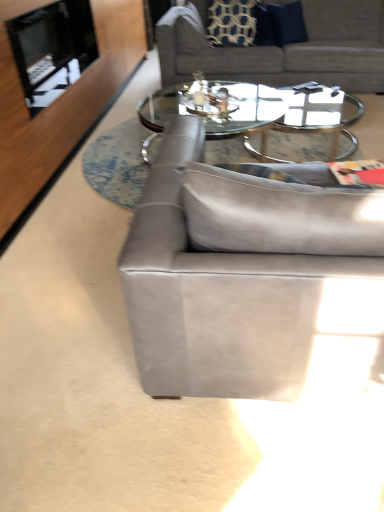
What do you see at coordinates (247, 274) in the screenshot? The height and width of the screenshot is (512, 384). I see `suede gray couch at center, the 1th studio couch viewed from the front` at bounding box center [247, 274].

The image size is (384, 512). What do you see at coordinates (253, 112) in the screenshot?
I see `clear glass coffee table at center` at bounding box center [253, 112].

The height and width of the screenshot is (512, 384). Describe the element at coordinates (282, 48) in the screenshot. I see `suede gray couch at upper center, which is counted as the 1th studio couch, starting from the top` at that location.

Identify the location of black glass fireplace at upper left. (52, 49).

This screenshot has width=384, height=512. Describe the element at coordinates (52, 49) in the screenshot. I see `black glass fireplace at upper left` at that location.

Identify the location of suede gray couch at center, the 1th studio couch positioned from the bottom. (247, 274).

Looking at the image, does black glass fireplace at upper left seem bigger or smaller compared to suede gray couch at center, the 1th studio couch viewed from the front?

Considering their sizes, black glass fireplace at upper left takes up less space than suede gray couch at center, the 1th studio couch viewed from the front.

From the image's perspective, which object appears higher, black glass fireplace at upper left or suede gray couch at center, the 1th studio couch viewed from the front?

From the image's view, black glass fireplace at upper left is above.

Considering the relative sizes of black glass fireplace at upper left and suede gray couch at center, the 1th studio couch viewed from the front, in the image provided, is black glass fireplace at upper left taller than suede gray couch at center, the 1th studio couch viewed from the front,?

In fact, black glass fireplace at upper left may be shorter than suede gray couch at center, the 1th studio couch viewed from the front.

Is clear glass coffee table at center next to suede gray couch at center, which appears as the 2th studio couch when viewed from the top?

clear glass coffee table at center and suede gray couch at center, which appears as the 2th studio couch when viewed from the top, are clearly separated.

Based on the photo, from a real-world perspective, is clear glass coffee table at center above or below suede gray couch at center, which is the 2th studio couch from back to front?

Clearly, from a real-world perspective, clear glass coffee table at center is below suede gray couch at center, which is the 2th studio couch from back to front.

Measure the distance from clear glass coffee table at center to suede gray couch at center, which is the 2th studio couch from back to front.

clear glass coffee table at center is 5.47 feet from suede gray couch at center, which is the 2th studio couch from back to front.

Considering the relative sizes of clear glass coffee table at center and suede gray couch at center, the 1th studio couch viewed from the front, in the image provided, is clear glass coffee table at center thinner than suede gray couch at center, the 1th studio couch viewed from the front,?

No.

Considering the relative sizes of suede gray couch at upper center, arranged as the 2th studio couch when ordered from the bottom, and suede gray couch at center, which is the 2th studio couch from back to front, in the image provided, is suede gray couch at upper center, arranged as the 2th studio couch when ordered from the bottom, thinner than suede gray couch at center, which is the 2th studio couch from back to front,?

No, suede gray couch at upper center, arranged as the 2th studio couch when ordered from the bottom, is not thinner than suede gray couch at center, which is the 2th studio couch from back to front.

You are a GUI agent. You are given a task and a screenshot of the screen. Output one action in this format:
    pyautogui.click(x=<x>, y=<y>)
    Task: Click on the studio couch positioned vertically above the suede gray couch at center, which is the 2th studio couch from back to front (from a real-world perspective)
    The height and width of the screenshot is (512, 384).
    Given the screenshot: What is the action you would take?
    pyautogui.click(x=282, y=48)

Can you confirm if suede gray couch at upper center, the 2th studio couch from the front, is smaller than suede gray couch at center, the 1th studio couch viewed from the front?

Incorrect, suede gray couch at upper center, the 2th studio couch from the front, is not smaller in size than suede gray couch at center, the 1th studio couch viewed from the front.

Does suede gray couch at center, the 1th studio couch viewed from the front, have a greater width compared to clear glass coffee table at center?

No.

How much distance is there between suede gray couch at center, which appears as the 2th studio couch when viewed from the top, and clear glass coffee table at center?

suede gray couch at center, which appears as the 2th studio couch when viewed from the top, is 1.67 meters from clear glass coffee table at center.

Based on the photo, considering the sizes of objects suede gray couch at center, the 1th studio couch positioned from the bottom, and clear glass coffee table at center in the image provided, who is bigger, suede gray couch at center, the 1th studio couch positioned from the bottom, or clear glass coffee table at center?

Bigger between the two is suede gray couch at center, the 1th studio couch positioned from the bottom.

Are suede gray couch at center, the 1th studio couch positioned from the bottom, and clear glass coffee table at center located far from each other?

Yes, suede gray couch at center, the 1th studio couch positioned from the bottom, and clear glass coffee table at center are quite far apart.

In terms of height, does black glass fireplace at upper left look taller or shorter compared to clear glass coffee table at center?

Clearly, black glass fireplace at upper left is taller compared to clear glass coffee table at center.

Would you say black glass fireplace at upper left is outside clear glass coffee table at center?

Yes, black glass fireplace at upper left is not within clear glass coffee table at center.

Which is more to the right, black glass fireplace at upper left or clear glass coffee table at center?

clear glass coffee table at center is more to the right.

From the image's perspective, is black glass fireplace at upper left on clear glass coffee table at center?

Indeed, from the image's perspective, black glass fireplace at upper left is shown above clear glass coffee table at center.

Based on the photo, is clear glass coffee table at center spatially inside suede gray couch at upper center, the 2th studio couch from the front, or outside of it?

clear glass coffee table at center cannot be found inside suede gray couch at upper center, the 2th studio couch from the front.

Can you confirm if clear glass coffee table at center is smaller than suede gray couch at upper center, which is the first studio couch in back-to-front order?

Correct, clear glass coffee table at center occupies less space than suede gray couch at upper center, which is the first studio couch in back-to-front order.

Measure the distance from clear glass coffee table at center to suede gray couch at upper center, the 2th studio couch from the front.

clear glass coffee table at center and suede gray couch at upper center, the 2th studio couch from the front, are 70.31 centimeters apart.

From a real-world perspective, relative to suede gray couch at upper center, the 2th studio couch from the front, is clear glass coffee table at center vertically above or below?

Clearly, from a real-world perspective, clear glass coffee table at center is below suede gray couch at upper center, the 2th studio couch from the front.

Could you tell me if suede gray couch at upper center, the 2th studio couch from the front, is facing black glass fireplace at upper left?

No, suede gray couch at upper center, the 2th studio couch from the front, is not turned towards black glass fireplace at upper left.

Is suede gray couch at upper center, the 2th studio couch from the front, situated inside black glass fireplace at upper left or outside?

suede gray couch at upper center, the 2th studio couch from the front, is not inside black glass fireplace at upper left, it's outside.

Considering their positions, is suede gray couch at upper center, the 2th studio couch from the front, located in front of or behind black glass fireplace at upper left?

suede gray couch at upper center, the 2th studio couch from the front, is behind black glass fireplace at upper left.

From a real-world perspective, relative to black glass fireplace at upper left, is suede gray couch at upper center, which is the first studio couch in back-to-front order, vertically above or below?

In terms of real-world spatial position, suede gray couch at upper center, which is the first studio couch in back-to-front order, is below black glass fireplace at upper left.

I want to click on studio couch below the black glass fireplace at upper left (from the image's perspective), so click(x=247, y=274).

Locate an element on the screen. coffee table on the right of the suede gray couch at center, which is the 2th studio couch from back to front is located at coordinates (253, 112).

Estimate the real-world distances between objects in this image. Which object is further from suede gray couch at upper center, the 2th studio couch from the front, suede gray couch at center, the 1th studio couch viewed from the front, or black glass fireplace at upper left?

suede gray couch at center, the 1th studio couch viewed from the front, lies further to suede gray couch at upper center, the 2th studio couch from the front, than the other object.

From the image, which object appears to be nearer to clear glass coffee table at center, suede gray couch at upper center, which is the first studio couch in back-to-front order, or suede gray couch at center, which is the 2th studio couch from back to front?

suede gray couch at upper center, which is the first studio couch in back-to-front order, is closer to clear glass coffee table at center.

Considering their positions, is black glass fireplace at upper left positioned further to suede gray couch at upper center, which is counted as the 1th studio couch, starting from the top, than suede gray couch at center, which is the 2th studio couch from back to front?

suede gray couch at center, which is the 2th studio couch from back to front, is further to suede gray couch at upper center, which is counted as the 1th studio couch, starting from the top.

Considering their positions, is suede gray couch at center, which is the 2th studio couch from back to front, positioned further to black glass fireplace at upper left than suede gray couch at upper center, the 2th studio couch from the front?

The object further to black glass fireplace at upper left is suede gray couch at center, which is the 2th studio couch from back to front.

From the image, which object appears to be farther from clear glass coffee table at center, suede gray couch at center, which is the 2th studio couch from back to front, or suede gray couch at upper center, arranged as the 2th studio couch when ordered from the bottom?

suede gray couch at center, which is the 2th studio couch from back to front, is positioned further to the anchor clear glass coffee table at center.

Looking at the image, which one is located closer to suede gray couch at upper center, arranged as the 2th studio couch when ordered from the bottom, suede gray couch at center, which is the 2th studio couch from back to front, or clear glass coffee table at center?

clear glass coffee table at center.

Considering their positions, is clear glass coffee table at center positioned closer to black glass fireplace at upper left than suede gray couch at upper center, which is the first studio couch in back-to-front order?

Among the two, clear glass coffee table at center is located nearer to black glass fireplace at upper left.

Estimate the real-world distances between objects in this image. Which object is further from clear glass coffee table at center, black glass fireplace at upper left or suede gray couch at center, the 1th studio couch viewed from the front?

Among the two, suede gray couch at center, the 1th studio couch viewed from the front, is located further to clear glass coffee table at center.

The image size is (384, 512). I want to click on coffee table positioned between suede gray couch at center, the 1th studio couch positioned from the bottom, and suede gray couch at upper center, the 2th studio couch from the front, from near to far, so click(253, 112).

Where is `coffee table between black glass fireplace at upper left and suede gray couch at upper center, arranged as the 2th studio couch when ordered from the bottom, in the horizontal direction`? coffee table between black glass fireplace at upper left and suede gray couch at upper center, arranged as the 2th studio couch when ordered from the bottom, in the horizontal direction is located at coordinates (253, 112).

Locate an element on the screen. studio couch situated between black glass fireplace at upper left and clear glass coffee table at center from left to right is located at coordinates [247, 274].

You are a GUI agent. You are given a task and a screenshot of the screen. Output one action in this format:
    pyautogui.click(x=<x>, y=<y>)
    Task: Click on the fireplace located between suede gray couch at center, the 1th studio couch viewed from the front, and suede gray couch at upper center, arranged as the 2th studio couch when ordered from the bottom, in the depth direction
    
    Given the screenshot: What is the action you would take?
    pyautogui.click(x=52, y=49)